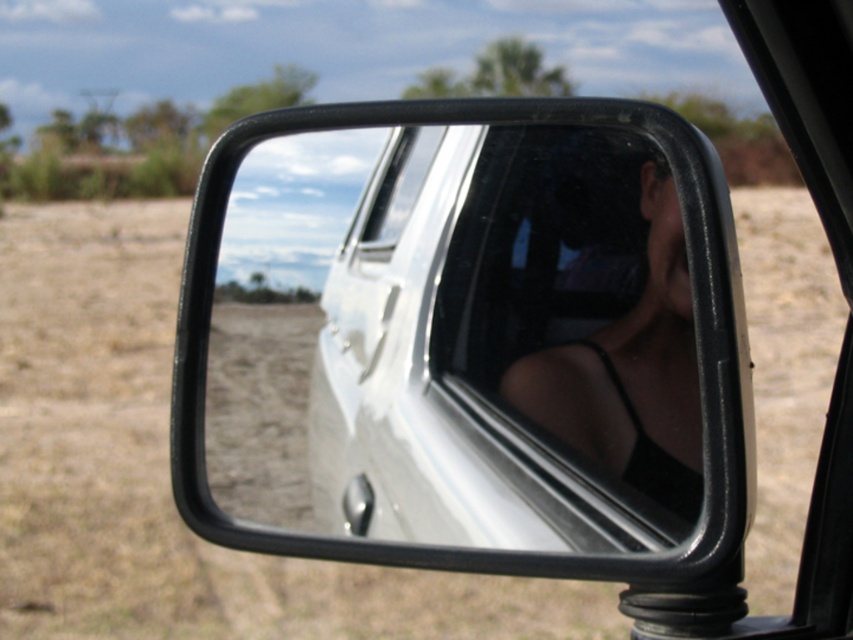
Question: Is black glossy mirror at center further to camera compared to clear glass window at center?

Choices:
 (A) no
 (B) yes

Answer: (A)

Question: Can you confirm if black glossy mirror at center is positioned below clear glass window at center?

Choices:
 (A) yes
 (B) no

Answer: (A)

Question: Estimate the real-world distances between objects in this image. Which object is closer to the clear glass window at center?

Choices:
 (A) black glossy mirror at center
 (B) transparent glass car window at center

Answer: (A)

Question: Which point is closer to the camera taking this photo?

Choices:
 (A) (560, 314)
 (B) (618, 168)

Answer: (B)

Question: Estimate the real-world distances between objects in this image. Which object is farther from the black glossy mirror at center?

Choices:
 (A) transparent glass car window at center
 (B) clear glass window at center

Answer: (B)

Question: Is black glossy mirror at center smaller than transparent glass car window at center?

Choices:
 (A) no
 (B) yes

Answer: (A)